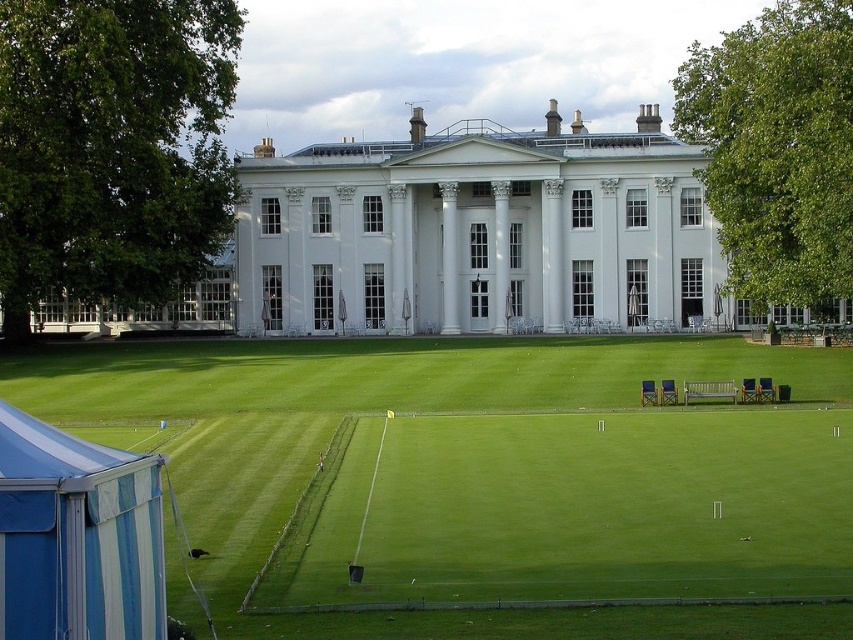
In the scene shown: Who is higher up, green grass at center or blue striped tent at lower left?

blue striped tent at lower left is higher up.

Does point (595, 576) come in front of point (54, 442)?

That is False.

In order to click on green grass at center in this screenshot , I will do `click(490, 477)`.